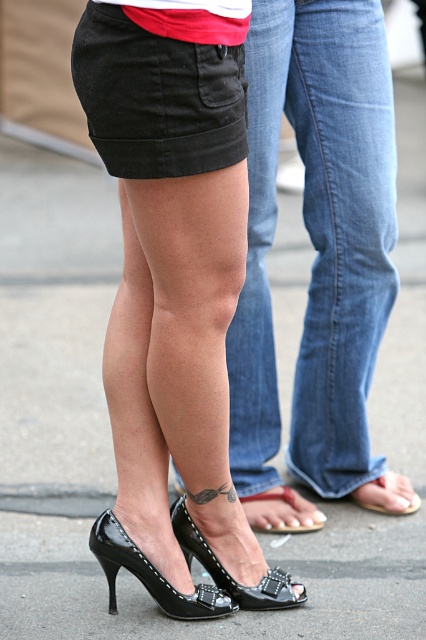
You are a photographer trying to capture a detailed shot of the tattoo on the left leg of the person in the foreground. You notice two points of interest marked as point 1 at coordinates point (291, 515) and point 2 at coordinates point (399, 512). Which point should you focus on to ensure the tattoo is clearly visible in your photo?

Point 1 at coordinates point (291, 515) is in front of point 2 at coordinates point (399, 512), so focusing on point 1 will ensure the tattoo is clearly visible.